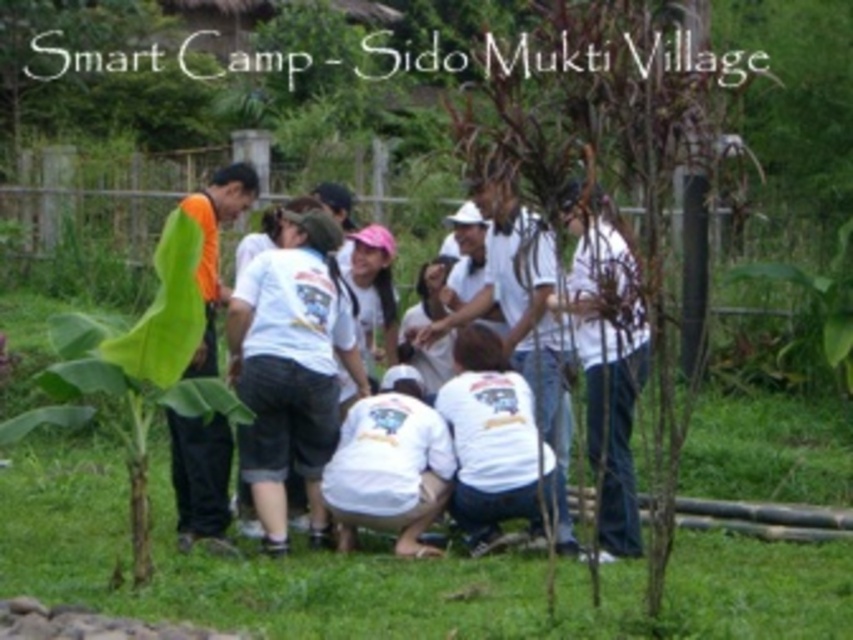
You are a photographer trying to capture a photo of the orange fabric shirt at left without the green leafy banana tree at left blocking the view. Is it possible to do so given their sizes?

The green leafy banana tree at left is larger than the orange fabric shirt at left, so it might block the view. However, since the banana tree is at the left and the shirt is also at the left, their positions might allow adjusting the angle to avoid obstruction. The exact possibility depends on their exact positions and distances, which aren

You are standing at the wooden fence in Sido Mukti Village and want to walk towards the point labeled as point (129,355). Which direction should you go relative to the other point, point (212,212)?

You should walk towards the point labeled as point (129,355), which is in front of point (212,212).

Looking at this image, you are organizing a clothing drive and need to determine which shirt can fit into a standard donation box that has a width capacity of 40 cm. Given that the white cotton shirt at center is wider than the orange fabric shirt at left, can both shirts be placed in the box without folding?

The white cotton shirt at center is wider than the orange fabric shirt at left. Since the donation box has a width capacity of 40 cm, we need to know the exact width of the white cotton shirt at center to determine if it can fit. However, the orange fabric shirt at left, being narrower, might fit if its width is under 40 cm. Without specific measurements, we can only confirm that the narrower orange fabric shirt at left has a better chance of fitting without folding.